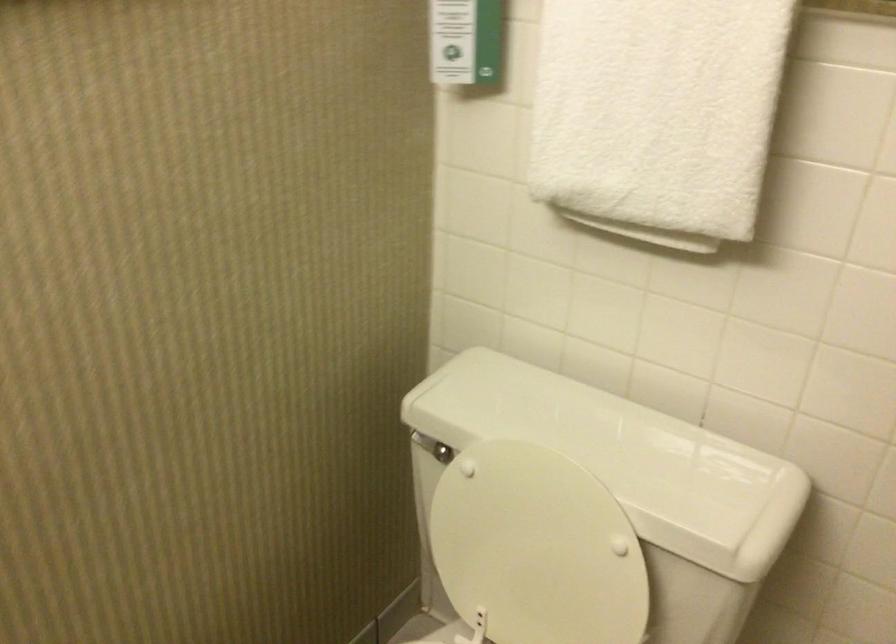
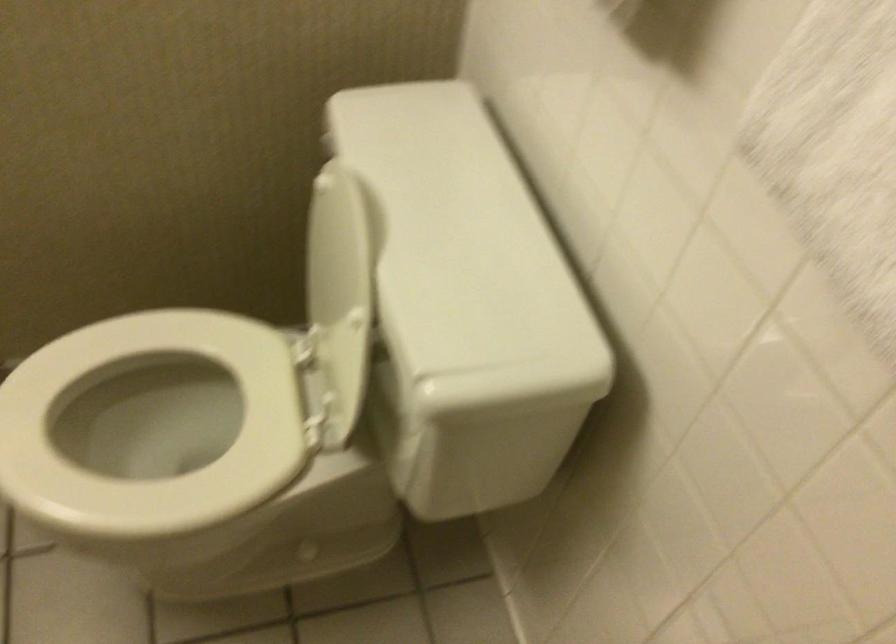
The images are taken continuously from a first-person perspective. In which direction is your viewpoint rotating?

The camera rotated toward left-down.